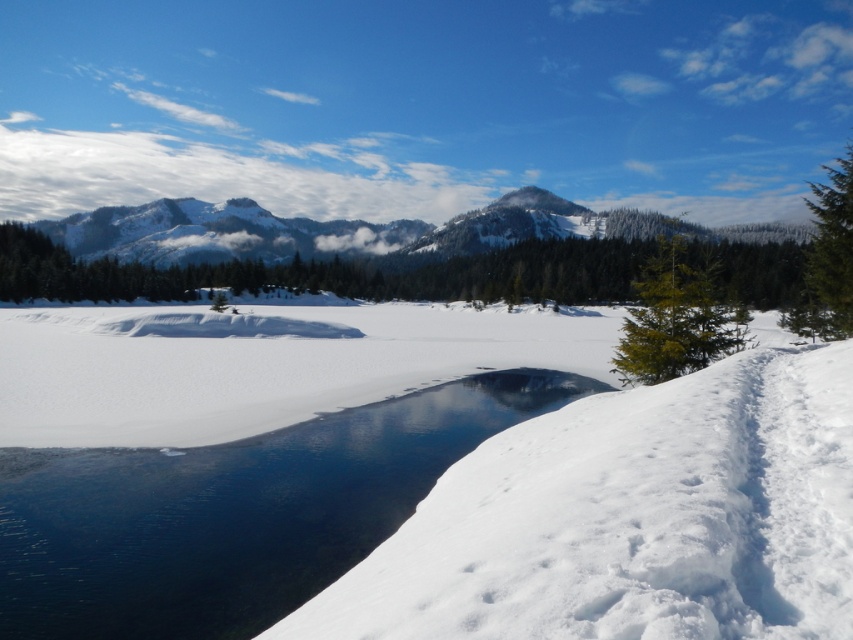
You are planning to cross the clear ice river at lower left and the green textured pine at right. Based on their widths, which path would be safer to choose?

The clear ice river at lower left is narrower than the green textured pine at right, so the green textured pine at right would be the safer path to choose.

You are an ice skater planning to glide across the clear ice river at lower left and the white fluffy snow at lower left. Which surface will you have more space to move on?

The white fluffy snow at lower left has a larger width than the clear ice river at lower left, so you will have more space to move on the white fluffy snow at lower left.

You are an outdoor photographer planning to capture the clear ice river at lower left and the green textured pine at right in a single shot. Which object should you focus on first to ensure both are in sharp focus?

You should focus on the clear ice river at lower left first because it is closer to the viewer than the green textured pine at right, so focusing on the closer object will help ensure both are in focus.